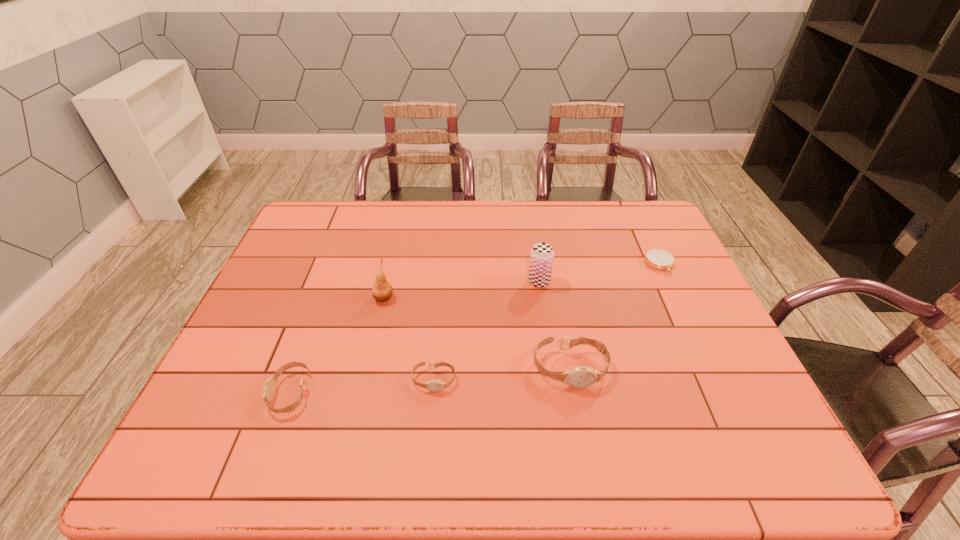
Locate an element on the screen. pear is located at coordinates (382, 290).

This screenshot has height=540, width=960. What are the coordinates of `blank space located on the face of the second shortest watch` in the screenshot? It's located at (215, 393).

Find the location of a particular element. The image size is (960, 540). vacant space located 0.110m on the face of the second shortest watch is located at coordinates (224, 393).

This screenshot has height=540, width=960. Find the location of `free location located 0.050m on the face of the second watch from left to right`. free location located 0.050m on the face of the second watch from left to right is located at coordinates (431, 412).

This screenshot has height=540, width=960. In order to click on vacant area situated 0.050m on the face of the tallest watch in this screenshot , I will do `click(578, 408)`.

I want to click on free point located 0.180m on the left of the shortest object, so click(588, 265).

Find the location of `vacant space positioned on the right of the beer can`. vacant space positioned on the right of the beer can is located at coordinates (684, 281).

At what (x,y) coordinates should I click in order to perform the action: click on vacant space located 0.400m on the right of the pear. Please return your answer as a coordinate pair (x, y). This screenshot has width=960, height=540. Looking at the image, I should click on (536, 298).

Identify the location of object at the left edge. (269, 389).

At what (x,y) coordinates should I click in order to perform the action: click on object located at the right edge. Please return your answer as a coordinate pair (x, y). Looking at the image, I should click on click(659, 259).